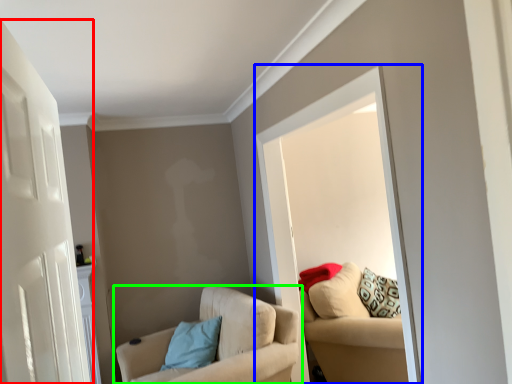
Question: Based on their relative distances, which object is nearer to door (highlighted by a red box)? Choose from window (highlighted by a blue box) and chair (highlighted by a green box).

Choices:
 (A) window
 (B) chair

Answer: (A)